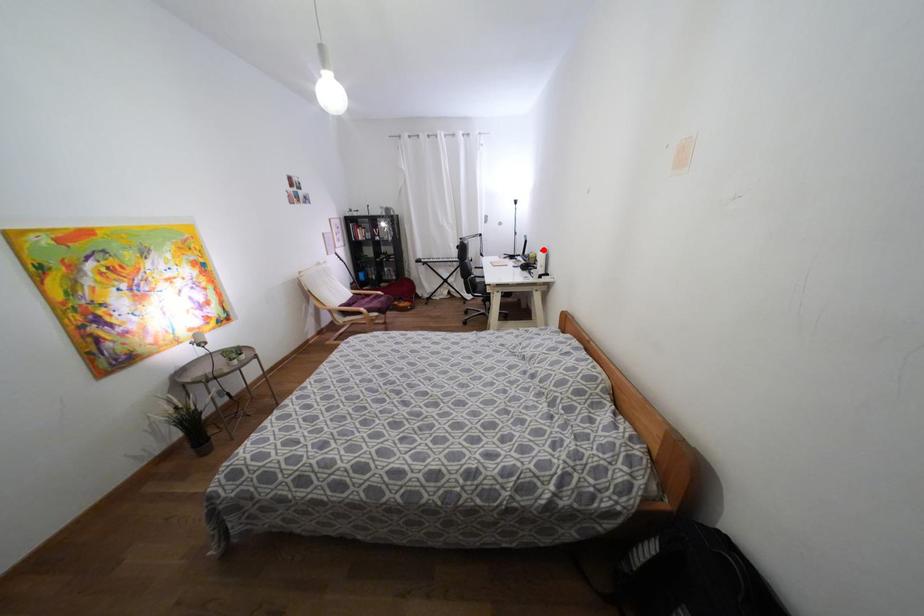
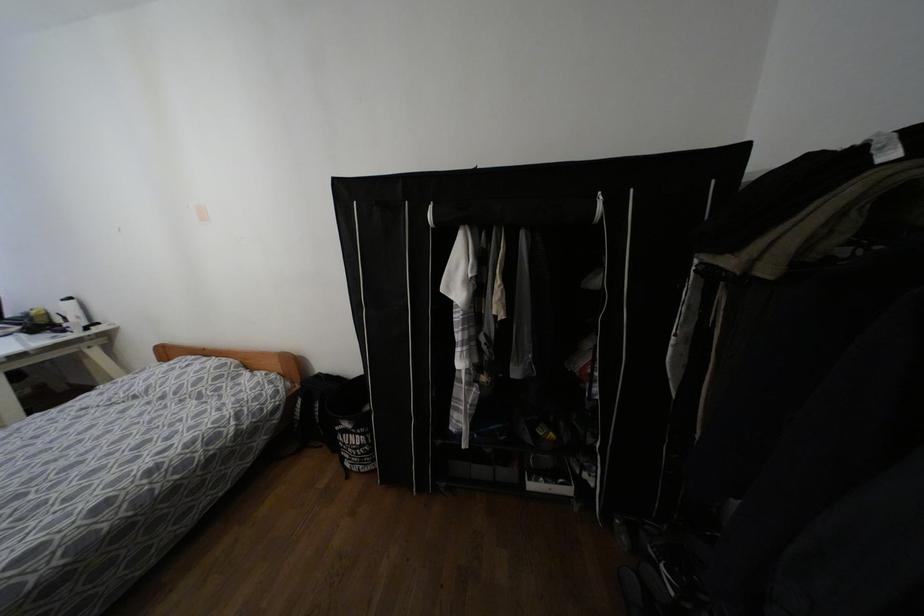
Find the pixel in the second image that matches the highlighted location in the first image.

(68, 299)